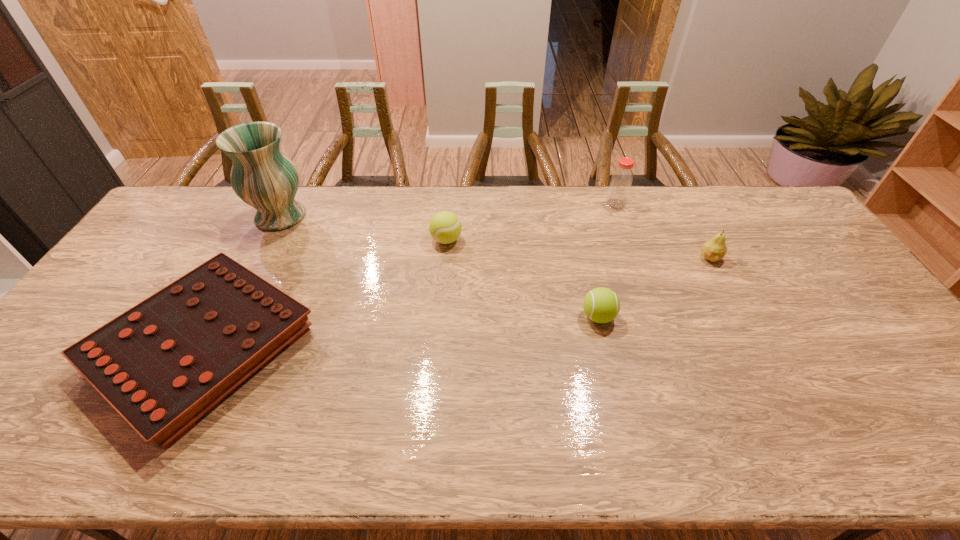
Image resolution: width=960 pixels, height=540 pixels. In the image, there is a desktop. Identify the location of free region at the far edge. (721, 188).

Locate an element on the screen. The height and width of the screenshot is (540, 960). vacant space at the near edge of the desktop is located at coordinates (840, 460).

The height and width of the screenshot is (540, 960). I want to click on free space at the left edge, so click(x=75, y=336).

You are a GUI agent. You are given a task and a screenshot of the screen. Output one action in this format:
    pyautogui.click(x=<x>, y=<y>)
    Task: Click on the free space at the right edge
    This screenshot has height=540, width=960.
    Given the screenshot: What is the action you would take?
    815,287

Identify the location of vacant region at the far left corner of the desktop. The image size is (960, 540). (184, 213).

This screenshot has height=540, width=960. Find the location of `empty location between the fourth object from right to left and the nearer tennis ball`. empty location between the fourth object from right to left and the nearer tennis ball is located at coordinates pyautogui.click(x=522, y=278).

Locate an element on the screen. free space between the third object from right to left and the tallest object is located at coordinates (440, 266).

Identify the location of empty space between the fourth object from left to right and the left tennis ball. This screenshot has width=960, height=540. (522, 278).

Locate an element on the screen. unoccupied area between the shortest object and the left tennis ball is located at coordinates (325, 294).

The width and height of the screenshot is (960, 540). I want to click on free space between the right tennis ball and the gameboard, so click(x=401, y=332).